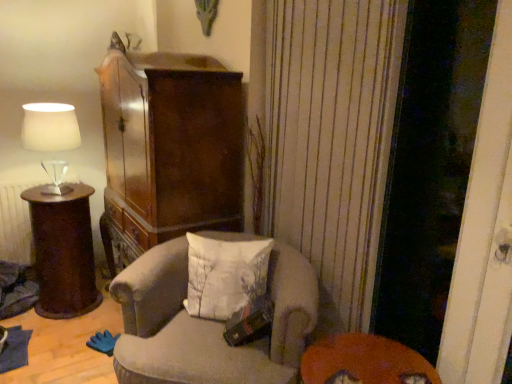
Question: Is velvet beige armchair at center wider than white fabric pillow at center?

Choices:
 (A) no
 (B) yes

Answer: (B)

Question: Is velvet beige armchair at center smaller than white fabric pillow at center?

Choices:
 (A) no
 (B) yes

Answer: (A)

Question: Is velvet beige armchair at center at the right side of white fabric pillow at center?

Choices:
 (A) yes
 (B) no

Answer: (B)

Question: Can you confirm if velvet beige armchair at center is taller than white fabric pillow at center?

Choices:
 (A) no
 (B) yes

Answer: (B)

Question: Is white fabric pillow at center completely or partially inside velvet beige armchair at center?

Choices:
 (A) yes
 (B) no

Answer: (A)

Question: Does velvet beige armchair at center have a lesser width compared to white fabric pillow at center?

Choices:
 (A) yes
 (B) no

Answer: (B)

Question: Can we say velvet beige armchair at center lies outside orange felt table at lower right?

Choices:
 (A) yes
 (B) no

Answer: (A)

Question: Does velvet beige armchair at center have a lesser height compared to orange felt table at lower right?

Choices:
 (A) no
 (B) yes

Answer: (A)

Question: Is velvet beige armchair at center to the left of orange felt table at lower right from the viewer's perspective?

Choices:
 (A) yes
 (B) no

Answer: (A)

Question: From the image's perspective, is velvet beige armchair at center located above orange felt table at lower right?

Choices:
 (A) yes
 (B) no

Answer: (A)

Question: Is velvet beige armchair at center not near orange felt table at lower right?

Choices:
 (A) yes
 (B) no

Answer: (B)

Question: Considering the relative sizes of velvet beige armchair at center and orange felt table at lower right in the image provided, is velvet beige armchair at center wider than orange felt table at lower right?

Choices:
 (A) no
 (B) yes

Answer: (B)

Question: Is dark brown polished wood side table at left positioned with its back to transparent glass screen door at right?

Choices:
 (A) yes
 (B) no

Answer: (B)